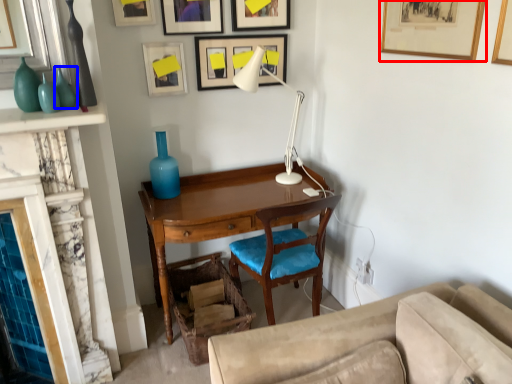
Question: Which object is further to the camera taking this photo, picture frame (highlighted by a red box) or glass vase (highlighted by a blue box)?

Choices:
 (A) picture frame
 (B) glass vase

Answer: (B)